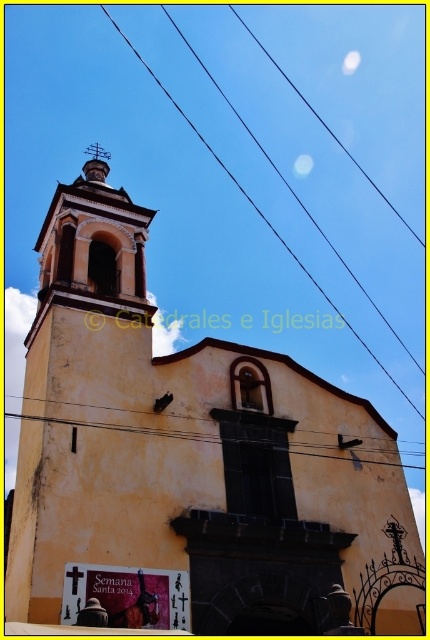
You are a bird flying towards the church. You see the yellowish matte power line at center and the smooth gold spire at upper center. Which object will you reach first?

The yellowish matte power line at center will be reached first because it is closer to the observer than the smooth gold spire at upper center, which is further away.

You are a drone operator trying to capture aerial footage of the church. Your drone has a maximum flight range of 150 meters. If you want to fly the drone to the black wire at upper center, will the drone be able to reach it without exceeding its range?

The black wire at upper center is 133.43 meters away from the camera, which is within the drone operator drone maximum flight range of 150 meters. Therefore, the drone can reach the black wire at upper center without exceeding its range.

You are an electrician assessing the churchyard for potential electrical upgrades. You notice the black wire at upper center and the yellowish matte power line at center. Which of these two wires is more suitable for carrying higher electrical loads, based on their thickness?

The yellowish matte power line at center is thicker than the black wire at upper center, making it more suitable for carrying higher electrical loads due to its larger diameter.